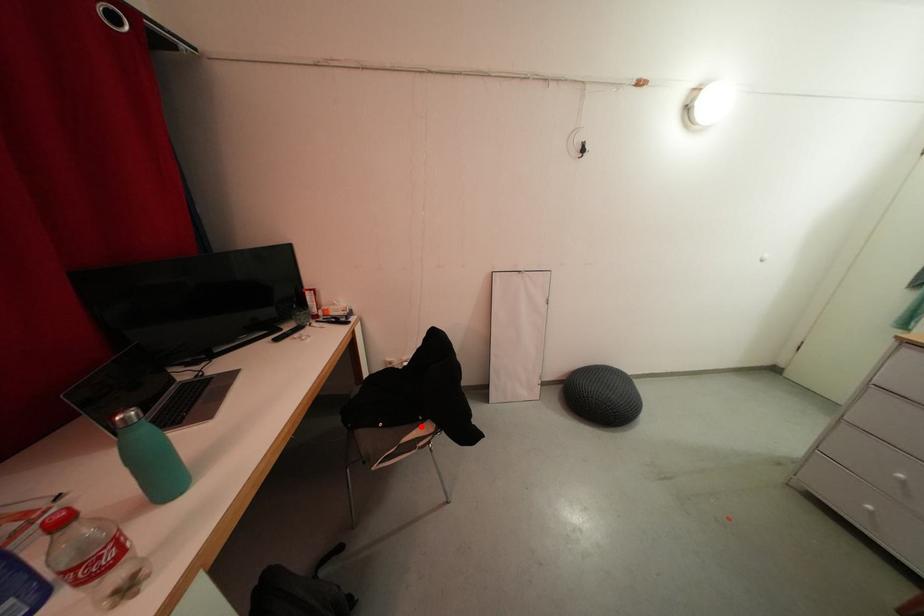
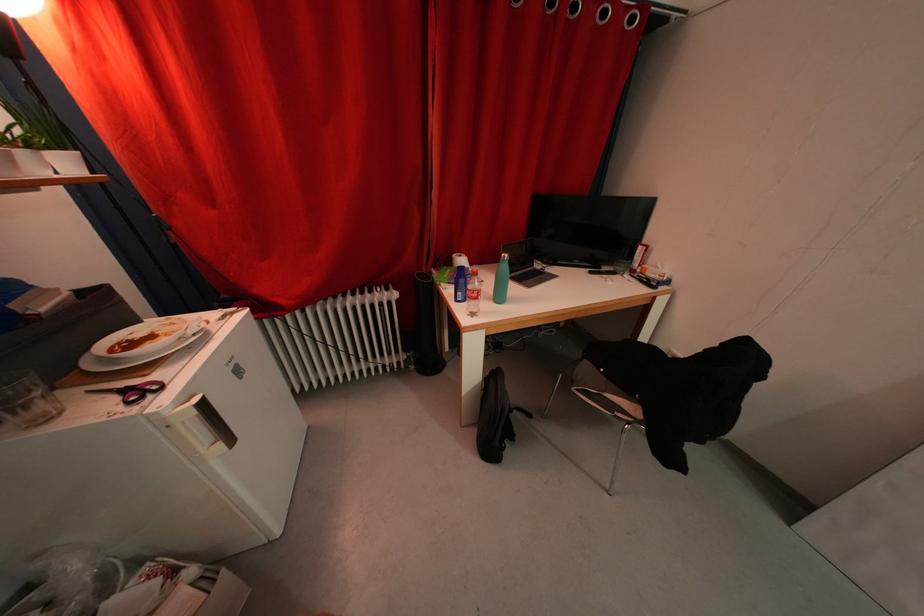
In the second image, find the point that corresponds to the highlighted location in the first image.

(636, 399)